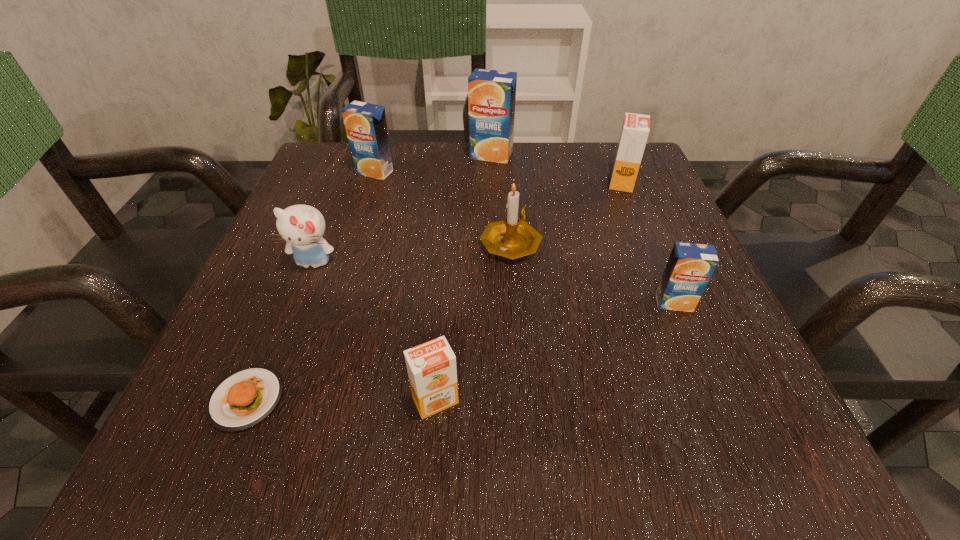
The width and height of the screenshot is (960, 540). What are the coordinates of `the left orange orange juice` in the screenshot? It's located at (431, 366).

Identify the location of the nearest orange juice. (431, 366).

In order to click on the shortest object in this screenshot , I will do `click(246, 397)`.

At what (x,y) coordinates should I click in order to perform the action: click on free region located 0.170m on the right of the tallest object. Please return your answer as a coordinate pair (x, y). The image size is (960, 540). Looking at the image, I should click on (588, 155).

At what (x,y) coordinates should I click in order to perform the action: click on free space located 0.290m on the right of the leftmost orange juice. Please return your answer as a coordinate pair (x, y). The width and height of the screenshot is (960, 540). Looking at the image, I should click on (527, 172).

What are the coordinates of `vacant space located on the front of the bigger orange orange juice` in the screenshot? It's located at (636, 217).

Locate an element on the screen. Image resolution: width=960 pixels, height=540 pixels. free space located on the front of the gold candle holder is located at coordinates (522, 390).

You are a GUI agent. You are given a task and a screenshot of the screen. Output one action in this format:
    pyautogui.click(x=<x>, y=<y>)
    Task: Click on the vacant area situated 0.150m on the front-facing side of the kitten
    The image size is (960, 540).
    Given the screenshot: What is the action you would take?
    pyautogui.click(x=278, y=351)

Locate an element on the screen. vacant space located on the back of the smallest blue orange_juice is located at coordinates (653, 252).

Locate an element on the screen. The image size is (960, 540). vacant position located on the back of the fourth object from left to right is located at coordinates (440, 346).